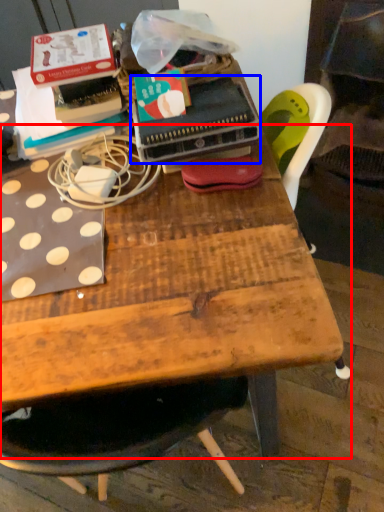
Question: Which object appears farthest to the camera in this image, table (highlighted by a red box) or paperback book (highlighted by a blue box)?

Choices:
 (A) table
 (B) paperback book

Answer: (A)